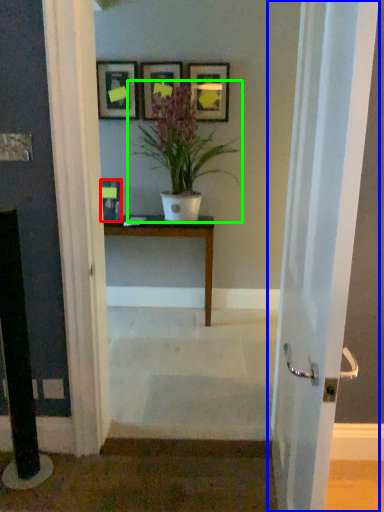
Question: Which object is the farthest from picture frame (highlighted by a red box)? Choose among these: door (highlighted by a blue box) or houseplant (highlighted by a green box).

Choices:
 (A) door
 (B) houseplant

Answer: (A)